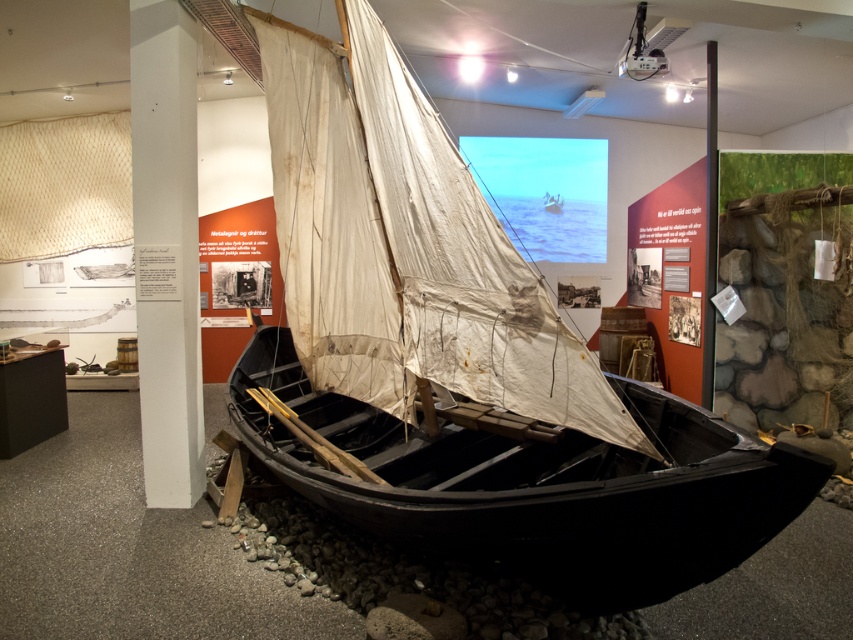
Can you confirm if white canvas sail at center is wider than black polished wood canoe at center?

Incorrect, white canvas sail at center's width does not surpass black polished wood canoe at center's.

Can you confirm if white canvas sail at center is positioned below black polished wood canoe at center?

Actually, white canvas sail at center is above black polished wood canoe at center.

Is point (531, 301) in front of point (672, 531)?

No.

Identify the location of white canvas sail at center. The height and width of the screenshot is (640, 853). (405, 248).